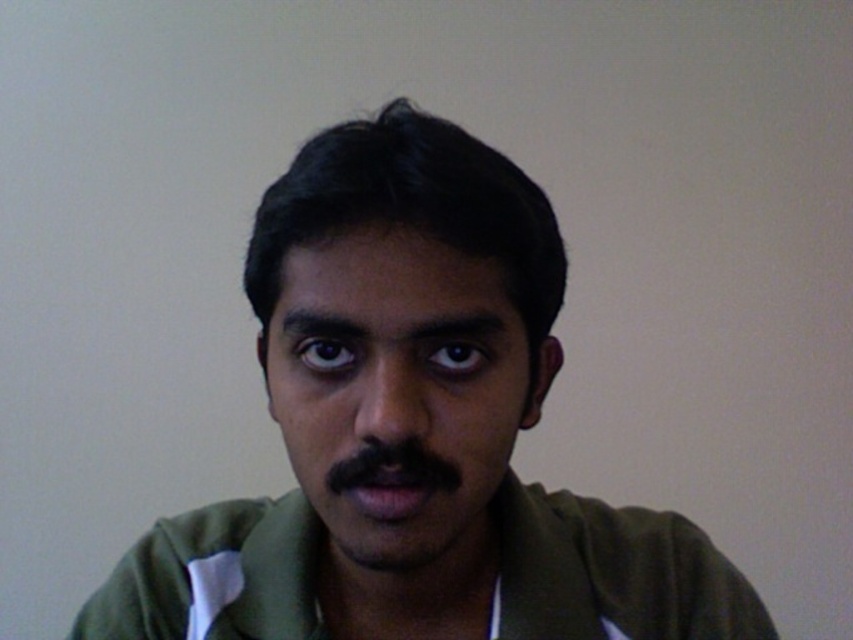
You are designing a portrait layout for a photo editing software. The subject has a green matte shirt at center and a matte green face at center. Which object should you adjust the size of to ensure the face is the focal point without overwhelming the composition?

Since the green matte shirt at center is wider than the matte green face at center, you should reduce the size of the green matte shirt at center to prevent it from overshadowing the face and maintain the face as the focal point.

Looking at the person in the image, which object is positioned to the right of the other between the green matte shirt at center and the matte green face at center?

The green matte shirt at center is positioned to the right of the matte green face at center.